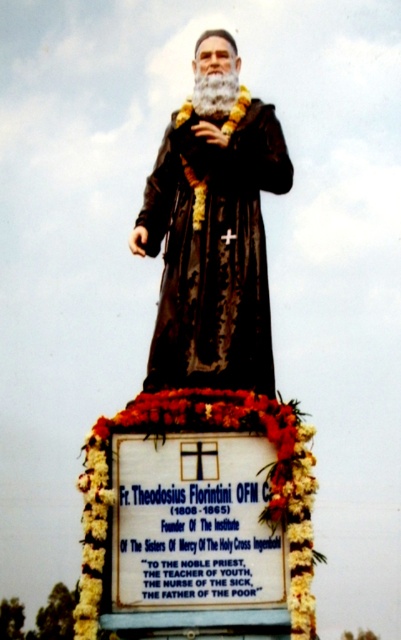
Question: Among these points, which one is nearest to the camera?

Choices:
 (A) (147, 403)
 (B) (153, 211)
 (C) (228, 570)

Answer: (C)

Question: Does black matte statue at center appear under floral garland at bottom?

Choices:
 (A) no
 (B) yes

Answer: (A)

Question: Which point is closer to the camera?

Choices:
 (A) floral garland at bottom
 (B) black matte statue at center
 (C) matte black robe at center

Answer: (A)

Question: Can you confirm if black matte statue at center is wider than floral garland at bottom?

Choices:
 (A) no
 (B) yes

Answer: (A)

Question: Based on their relative distances, which object is farther from the black matte statue at center?

Choices:
 (A) matte black robe at center
 (B) floral garland at bottom

Answer: (B)

Question: Does black matte statue at center appear over matte black robe at center?

Choices:
 (A) yes
 (B) no

Answer: (A)